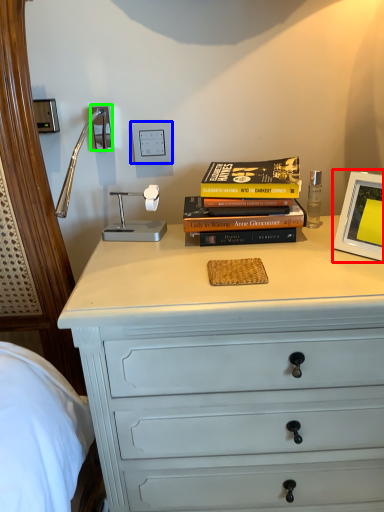
Question: Estimate the real-world distances between objects in this image. Which object is closer to picture frame (highlighted by a red box), electric outlet (highlighted by a blue box) or electric outlet (highlighted by a green box)?

Choices:
 (A) electric outlet
 (B) electric outlet

Answer: (A)